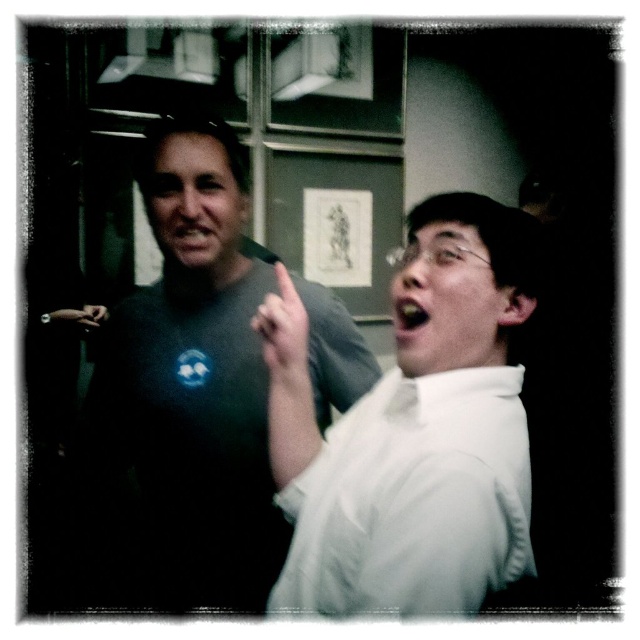
Question: Considering the real-world distances, which object is closest to the white matte finger at center?

Choices:
 (A) dark gray t-shirt at upper left
 (B) smooth yellowish mouth at center
 (C) white cotton shirt at right
 (D) matte black hand at upper left

Answer: (A)

Question: Which object is farther from the camera taking this photo?

Choices:
 (A) dark gray t-shirt at upper left
 (B) white matte finger at center

Answer: (A)

Question: Can you confirm if dark gray t-shirt at upper left is positioned above white cotton shirt at right?

Choices:
 (A) no
 (B) yes

Answer: (B)

Question: In this image, where is white cotton shirt at right located relative to matte black hand at upper left?

Choices:
 (A) left
 (B) right

Answer: (B)

Question: Is white cotton shirt at right wider than matte black hand at upper left?

Choices:
 (A) no
 (B) yes

Answer: (B)

Question: Which of the following is the farthest from the observer?

Choices:
 (A) dark gray t-shirt at upper left
 (B) white matte finger at center
 (C) matte black hand at upper left
 (D) smooth yellowish mouth at center

Answer: (C)